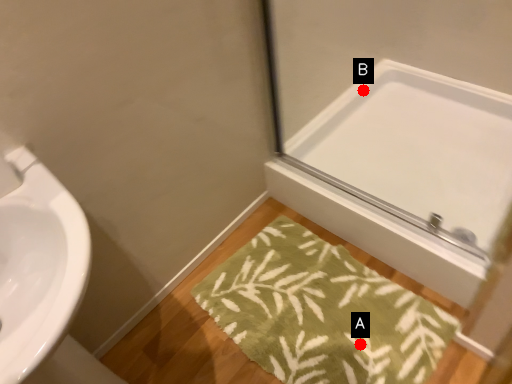
Question: Two points are circled on the image, labeled by A and B beside each circle. Which point is closer to the camera?

Choices:
 (A) A is closer
 (B) B is closer

Answer: (A)